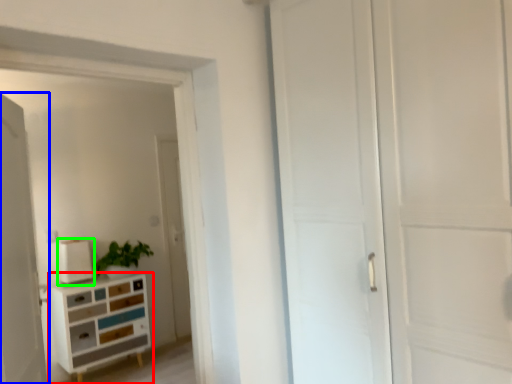
Question: Considering the real-world distances, which object is closest to chest of drawers (highlighted by a red box)? door (highlighted by a blue box) or appliance (highlighted by a green box).

Choices:
 (A) door
 (B) appliance

Answer: (B)